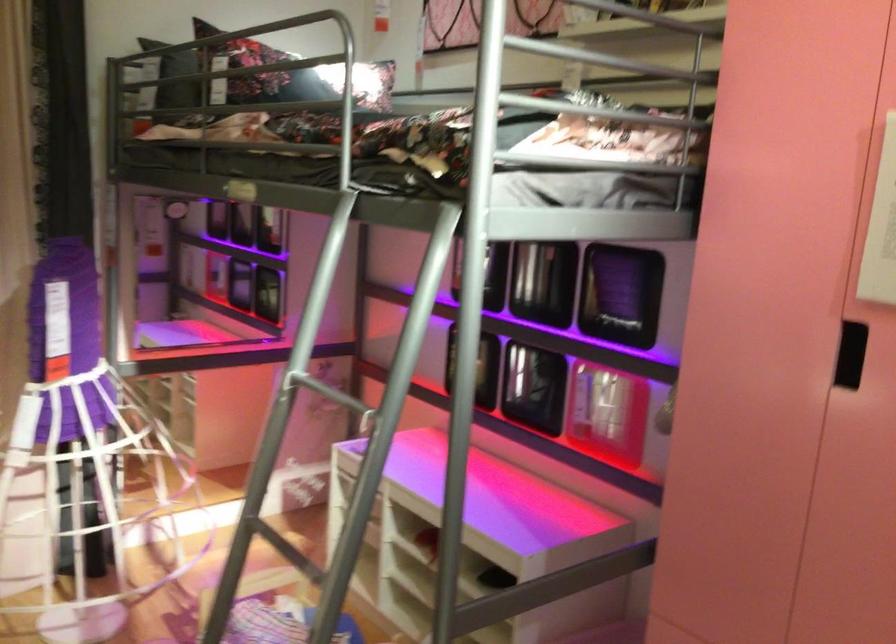
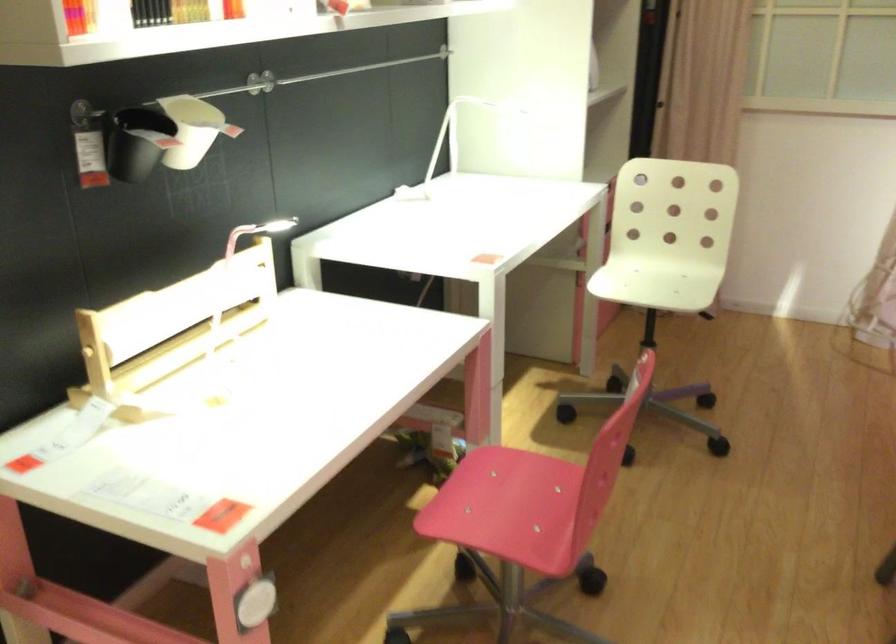
Question: The images are taken continuously from a first-person perspective. In which direction is your viewpoint rotating?

Choices:
 (A) Left
 (B) Right
 (C) Up
 (D) Down

Answer: (A)